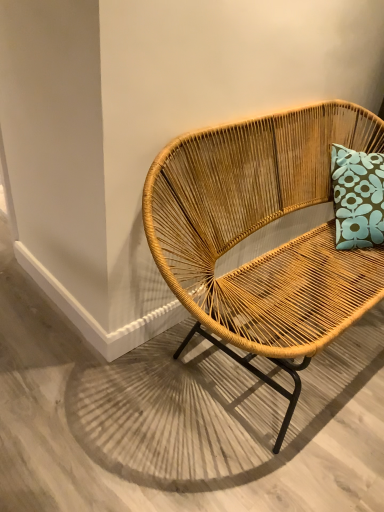
Find the location of a particular element. The width and height of the screenshot is (384, 512). natural woven chair at center is located at coordinates (257, 230).

The height and width of the screenshot is (512, 384). What do you see at coordinates (257, 230) in the screenshot?
I see `natural woven chair at center` at bounding box center [257, 230].

Image resolution: width=384 pixels, height=512 pixels. Describe the element at coordinates (180, 422) in the screenshot. I see `natural wood chair at center` at that location.

Where is `natural wood chair at center`? The height and width of the screenshot is (512, 384). natural wood chair at center is located at coordinates (180, 422).

Image resolution: width=384 pixels, height=512 pixels. What are the coordinates of `natural woven chair at center` in the screenshot? It's located at (257, 230).

Visually, is natural wood chair at center positioned to the left or to the right of natural woven chair at center?

Clearly, natural wood chair at center is on the left of natural woven chair at center in the image.

Who is more distant, natural wood chair at center or natural woven chair at center?

natural wood chair at center.

Considering the positions of point (226, 426) and point (306, 151), is point (226, 426) closer or farther from the camera than point (306, 151)?

Point (226, 426) is closer to the camera than point (306, 151).

In the scene shown: From the image's perspective, is natural wood chair at center located above natural woven chair at center?

No, from the image's perspective, natural wood chair at center is not above natural woven chair at center.

From a real-world perspective, is natural wood chair at center physically located above or below natural woven chair at center?

Clearly, from a real-world perspective, natural wood chair at center is below natural woven chair at center.

Considering the relative sizes of natural wood chair at center and natural woven chair at center in the image provided, is natural wood chair at center wider than natural woven chair at center?

Correct, the width of natural wood chair at center exceeds that of natural woven chair at center.

Does natural wood chair at center have a greater height compared to natural woven chair at center?

No.

Which of these two, natural wood chair at center or natural woven chair at center, is smaller?

Smaller between the two is natural wood chair at center.

Is natural wood chair at center not within natural woven chair at center?

Indeed, natural wood chair at center is completely outside natural woven chair at center.

Would you say natural wood chair at center is a long distance from natural woven chair at center?

No, there isn't a large distance between natural wood chair at center and natural woven chair at center.

Could you tell me if natural wood chair at center is turned towards natural woven chair at center?

No, natural wood chair at center is not turned towards natural woven chair at center.

Can you tell me how much natural wood chair at center and natural woven chair at center differ in facing direction?

89.2 degrees separate the facing orientations of natural wood chair at center and natural woven chair at center.

You are a GUI agent. You are given a task and a screenshot of the screen. Output one action in this format:
    pyautogui.click(x=<x>, y=<y>)
    Task: Click on the concrete below the natural woven chair at center (from the image's perspective)
    This screenshot has height=512, width=384.
    Given the screenshot: What is the action you would take?
    pyautogui.click(x=180, y=422)

Between natural woven chair at center and natural wood chair at center, which one appears on the right side from the viewer's perspective?

natural woven chair at center is more to the right.

Is natural woven chair at center further to the viewer compared to natural wood chair at center?

No, it is not.

Does point (259, 338) lie behind point (95, 461)?

No, it is not.

From the image's perspective, which one is positioned higher, natural woven chair at center or natural wood chair at center?

natural woven chair at center is shown above in the image.

From a real-world perspective, is natural woven chair at center located higher than natural wood chair at center?

Correct, in the physical world, natural woven chair at center is higher than natural wood chair at center.

Is natural woven chair at center thinner than natural wood chair at center?

Yes, natural woven chair at center is thinner than natural wood chair at center.

In terms of height, does natural woven chair at center look taller or shorter compared to natural wood chair at center?

In the image, natural woven chair at center appears to be taller than natural wood chair at center.

Does natural woven chair at center have a smaller size compared to natural wood chair at center?

No, natural woven chair at center is not smaller than natural wood chair at center.

Does natural woven chair at center contain natural wood chair at center?

No, natural wood chair at center is located outside of natural woven chair at center.

Is natural woven chair at center far away from natural wood chair at center?

No.

Is natural wood chair at center at the back of natural woven chair at center?

No, natural wood chair at center is not at the back of natural woven chair at center.

How many degrees apart are the facing directions of natural woven chair at center and natural wood chair at center?

The angular difference between natural woven chair at center and natural wood chair at center is 89.2 degrees.

Measure the distance from natural woven chair at center to natural wood chair at center.

A: natural woven chair at center and natural wood chair at center are 17.70 inches apart from each other.

Find the location of `chair on the right of natural wood chair at center`. chair on the right of natural wood chair at center is located at coordinates (257, 230).

I want to click on chair above the natural wood chair at center (from the image's perspective), so click(x=257, y=230).

Find the location of a particular element. concrete that is below the natural woven chair at center (from the image's perspective) is located at coordinates (180, 422).